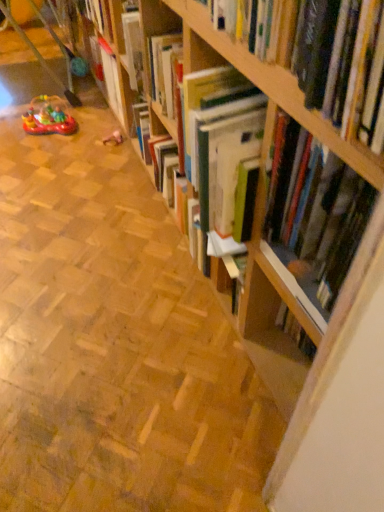
Where is `vacant space that's between rubber boat at left, placed as the second toy when sorted from right to left, and rubberized plastic toy at center, which is the first toy in right-to-left order`? vacant space that's between rubber boat at left, placed as the second toy when sorted from right to left, and rubberized plastic toy at center, which is the first toy in right-to-left order is located at coordinates (86, 137).